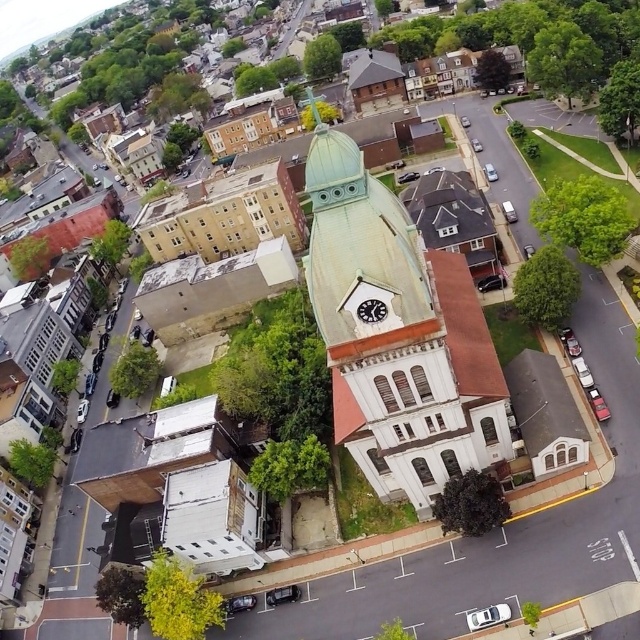
You are a drone operator flying over the town and need to deliver a package to the light brown brick building at upper left. The drone has a maximum payload capacity of 5 kg. The package weighs 4.5 kg. However, the drone can only carry the package if the building is smaller than the green copper dome at center. Can the drone safely deliver the package?

The green copper dome at center is bigger than the light brown brick building at upper left. Since the light brown brick building at upper left is smaller than the green copper dome at center, the drone can safely deliver the package as it meets the size requirement and the weight is within the payload capacity.

You are a drone operator flying over the town and need to deliver a package to the light brown brick building at upper left. From your current position above the green copper dome at center, in which direction should you fly to reach the building?

The green copper dome at center is below the light brown brick building at upper left, so you should fly upwards to reach the building.

You are looking at an aerial view of a town and see a point marked at coordinates [397,333]. What does this point represent?

The point at coordinates [397,333] indicates the green copper dome at center.